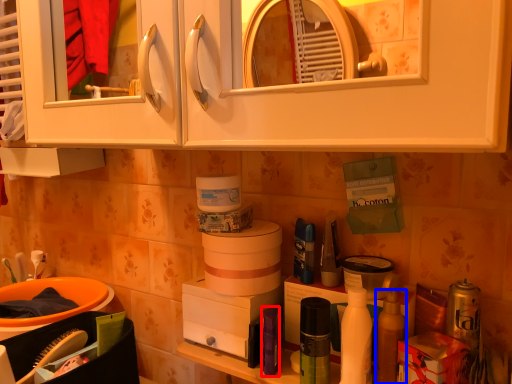
Question: Which object appears closest to the camera in this image, toiletry (highlighted by a red box) or mouthwash (highlighted by a blue box)?

Choices:
 (A) toiletry
 (B) mouthwash

Answer: (B)